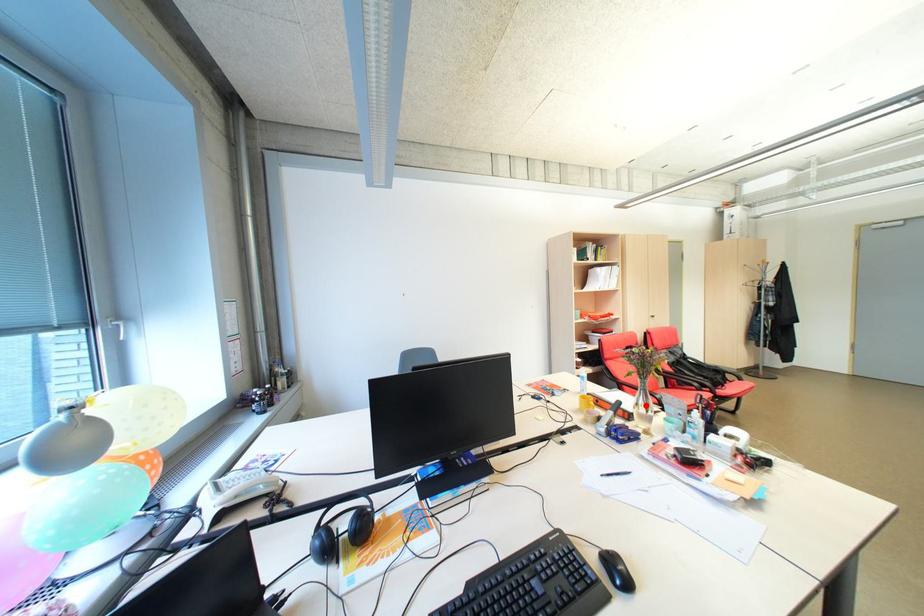
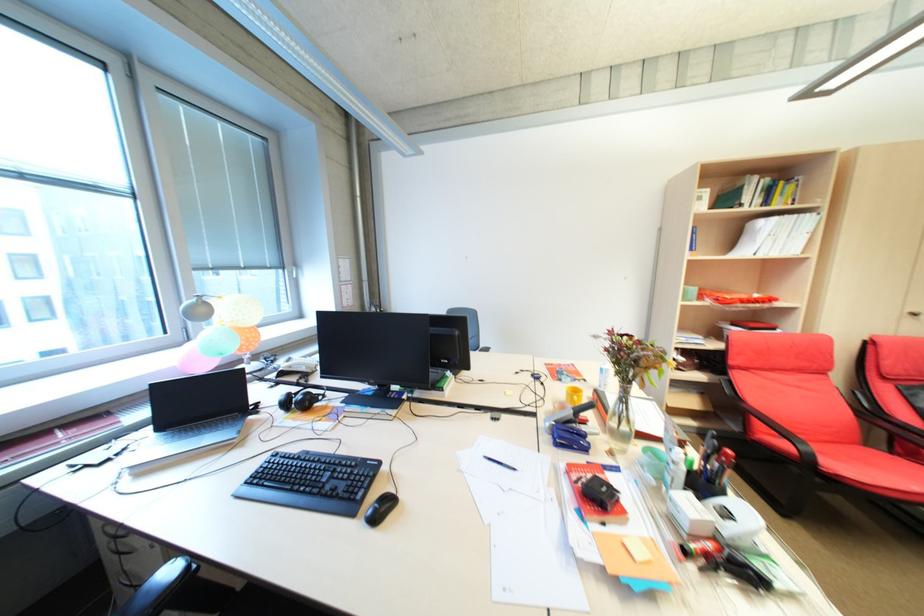
Find the pixel in the second image that matches the highlighted location in the first image.

(623, 416)